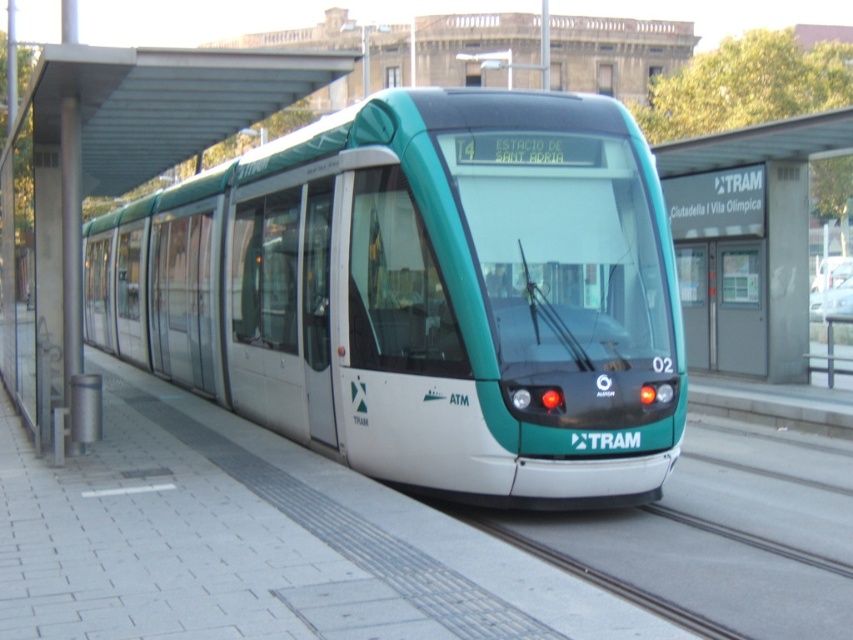
You are a passenger waiting at the station. You see the green matte tram at center and the metallic silver bus stop at center. Which one is located to the right side from your perspective?

The green matte tram at center is to the right of the metallic silver bus stop at center, so from your perspective, the green matte tram at center is on the right side.

You are standing at the platform of the tram station. There is a green matte tram at center. Where is the green matte tram located in relation to the platform?

The green matte tram at center is located at point (421, 292) on the platform.